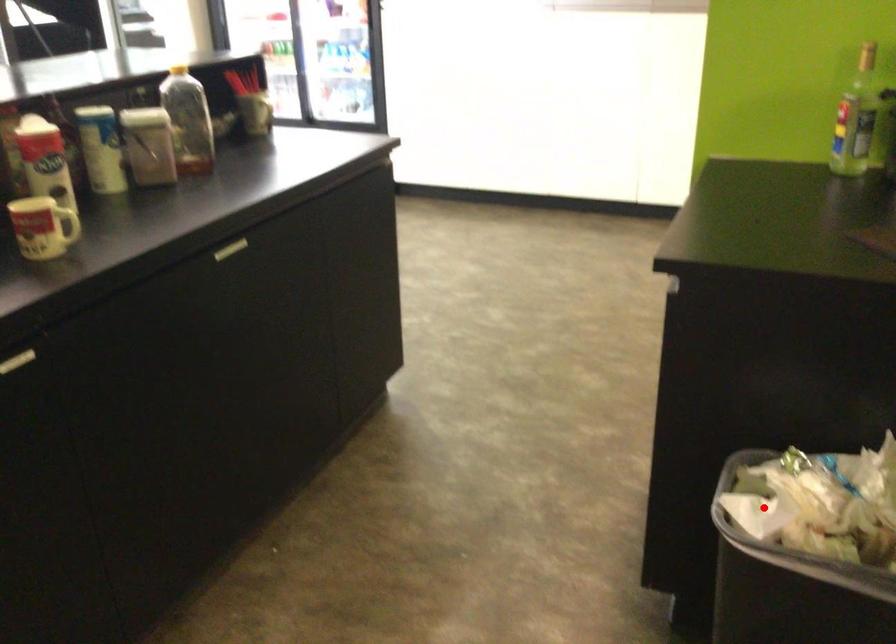
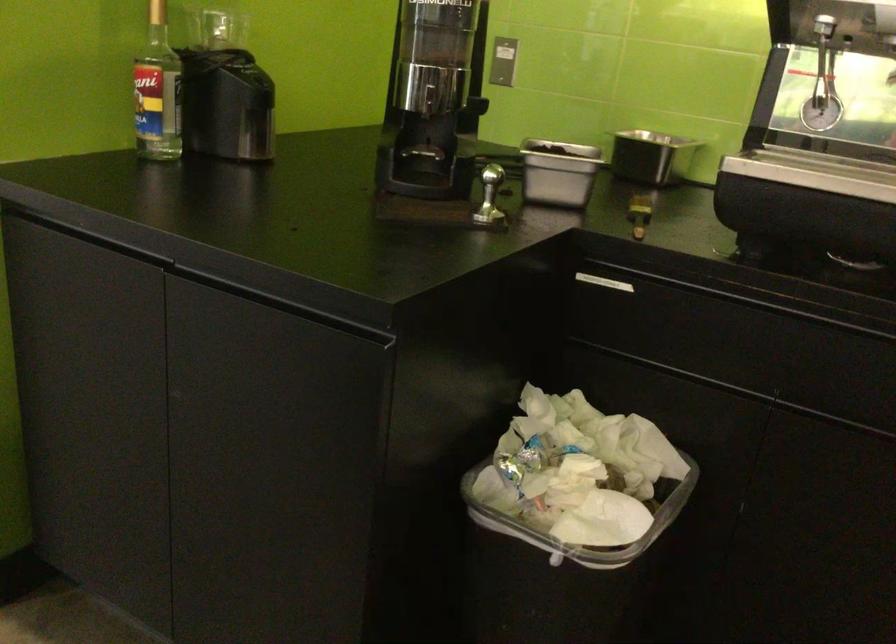
The point at the highlighted location is marked in the first image. Where is the corresponding point in the second image?

(581, 524)